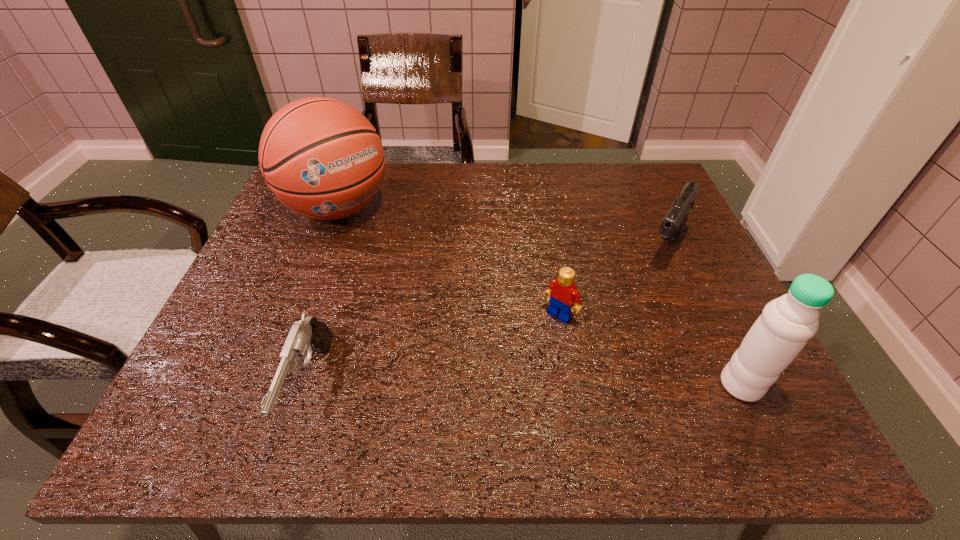
I want to click on free space between the water bottle and the pistol, so click(x=703, y=316).

I want to click on free space between the gun and the basketball, so click(324, 298).

Where is `vacant area that lies between the water bottle and the basketball`? This screenshot has height=540, width=960. vacant area that lies between the water bottle and the basketball is located at coordinates (540, 296).

Identify the location of free point between the third object from left to right and the water bottle. (650, 350).

This screenshot has width=960, height=540. In order to click on free space between the Lego and the water bottle in this screenshot , I will do `click(650, 350)`.

Locate an element on the screen. This screenshot has height=540, width=960. blank region between the water bottle and the third object from left to right is located at coordinates tap(650, 350).

Locate an element on the screen. The image size is (960, 540). free point between the water bottle and the basketball is located at coordinates (540, 296).

In order to click on vacant area that lies between the basketball and the gun in this screenshot , I will do `click(324, 298)`.

Find the location of `vacant point located between the basketball and the gun`. vacant point located between the basketball and the gun is located at coordinates (324, 298).

The height and width of the screenshot is (540, 960). I want to click on free space between the basketball and the Lego, so click(x=448, y=261).